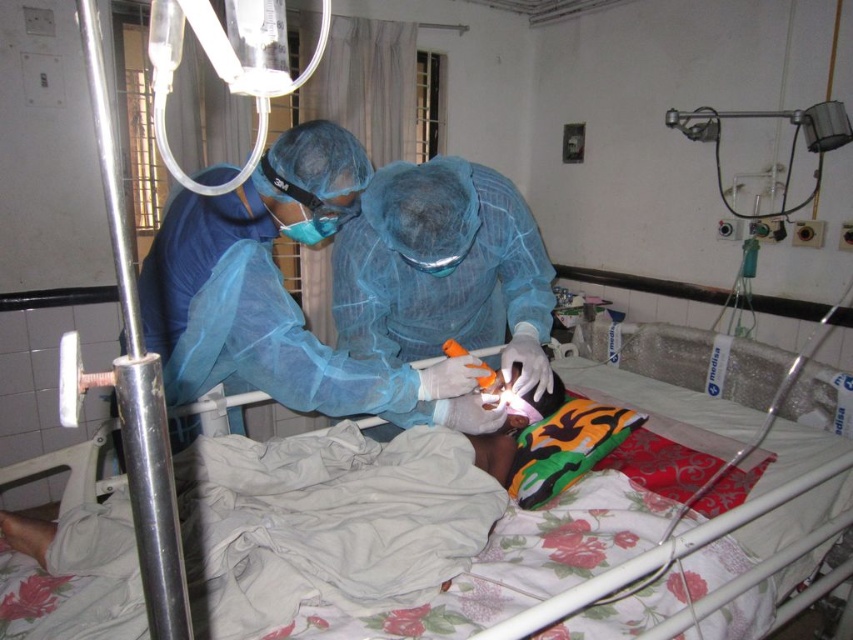
You are a nurse preparing to move a medical tray from the IV stand to the bed. The tray is the same size as the blue mesh gown at center. Will the tray fit on the floral fabric hospital bed at center?

The floral fabric hospital bed at center is bigger than the blue mesh gown at center, so the tray, which is the same size as the gown, will fit on the bed.